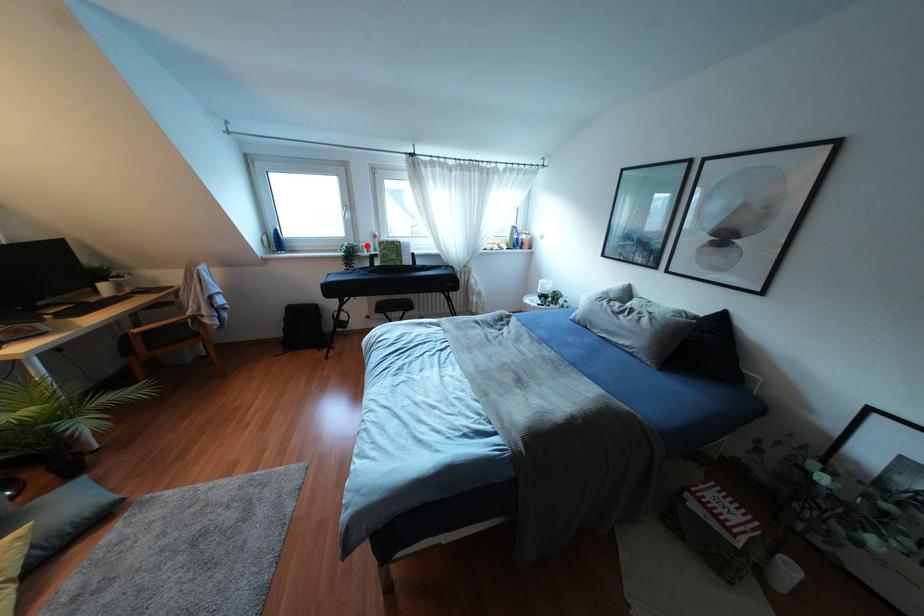
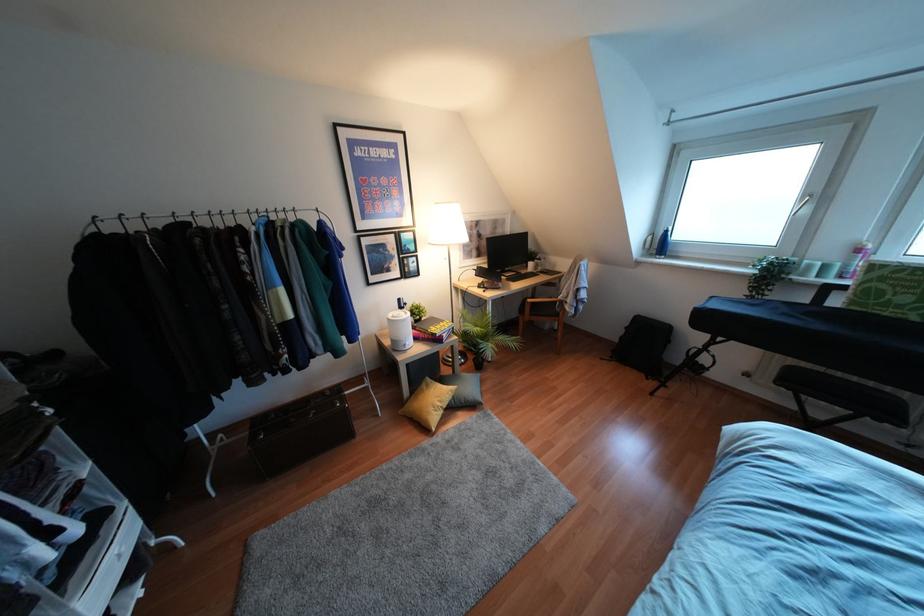
Question: I am providing you with two images of the same scene from different viewpoints. Given a red point in image1, look at the same physical point in image2. Is it:

Choices:
 (A) Closer to the viewpoint
 (B) Farther from the viewpoint

Answer: (B)